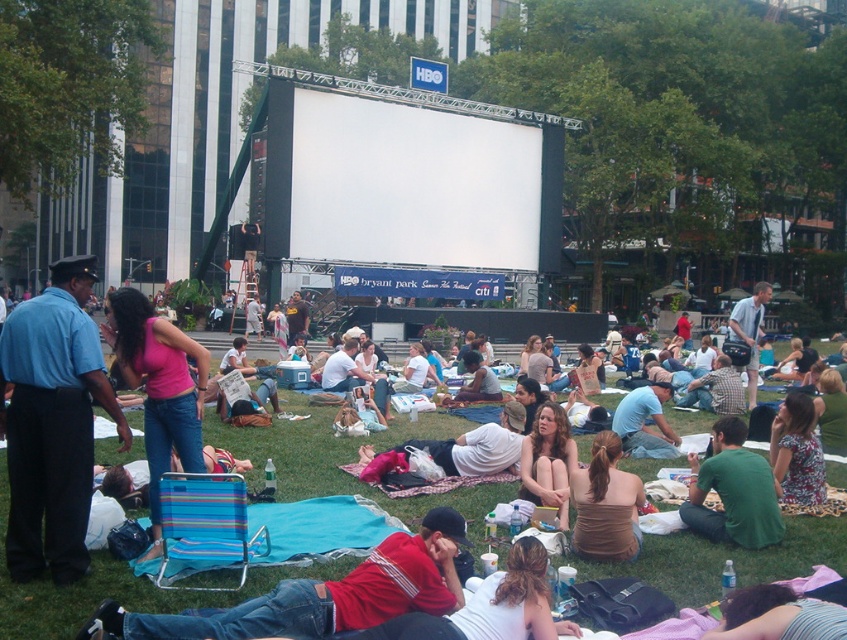
Question: Estimate the real-world distances between objects in this image. Which object is closer to the matte blue shirt at center?

Choices:
 (A) white cotton shirt at center
 (B) blue uniform at center
 (C) matte pink bikini top at lower right
 (D) green cotton shirt at center

Answer: (A)

Question: Which is nearer to the red cotton shirt at center?

Choices:
 (A) green cotton shirt at center
 (B) matte pink bikini top at lower right
 (C) green grass at center

Answer: (B)

Question: Which of these objects is positioned closest to the blue uniform at center?

Choices:
 (A) brown fabric top at center
 (B) matte pink bikini top at lower right

Answer: (A)

Question: Is green grass at center in front of red cotton shirt at center?

Choices:
 (A) no
 (B) yes

Answer: (A)

Question: Observing the image, what is the correct spatial positioning of white cotton shirt at center in reference to matte blue shirt at center?

Choices:
 (A) above
 (B) below

Answer: (B)

Question: Can you confirm if green grass at center is positioned to the left of matte pink bikini top at lower right?

Choices:
 (A) yes
 (B) no

Answer: (A)